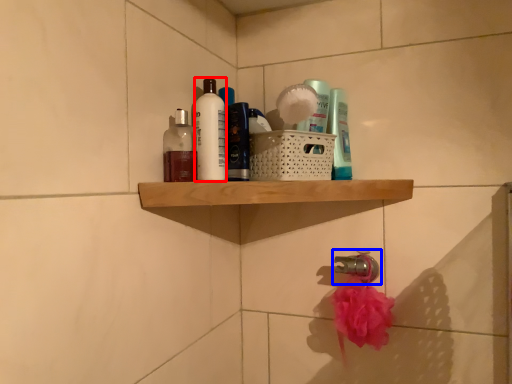
Question: Which point is closer to the camera, cleaning product (highlighted by a red box) or tap (highlighted by a blue box)?

Choices:
 (A) cleaning product
 (B) tap

Answer: (A)